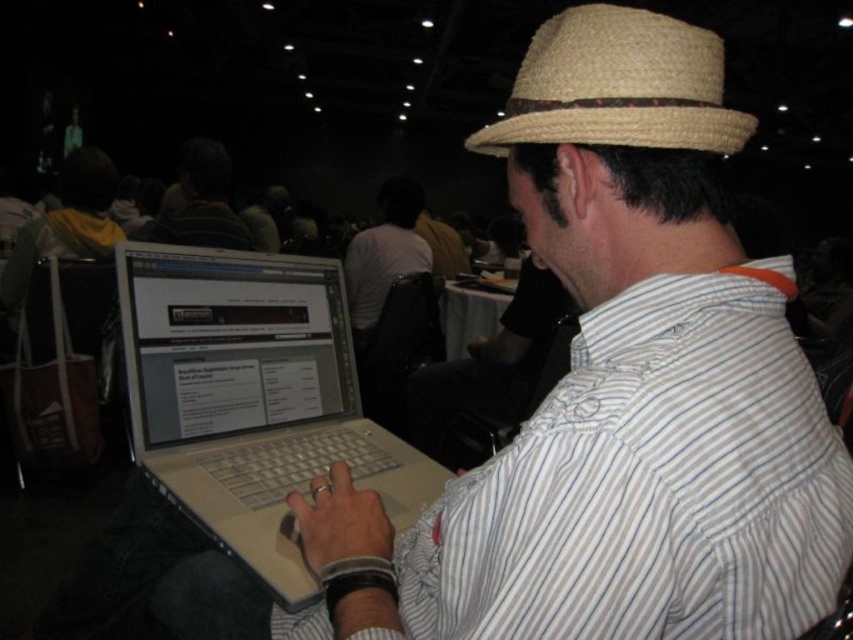
You are standing in the conference hall and want to take a photo of the point at coordinates point (679, 28). Your camera has a focal length of 50mm and a sensor size of 24mm. What is the minimum distance you need to move forward or backward to ensure the point is within the camera frame?

The point at coordinates point (679, 28) is 21.72 inches away from the viewer. To ensure it is within the camera frame, you need to adjust your distance based on the camera specifications. However, without knowing the required field of view or sensor resolution, an exact distance cannot be calculated. Please provide additional details about the desired framing or sensor resolution for a precise answer.

You are a photographer trying to capture a candid shot of the person at the conference. The white striped shirt at center and the silver metallic laptop at center are in your frame. Considering the focus distance, which object should you focus on to ensure both are in sharp focus if your camera has a depth of field that can cover 10 inches?

The white striped shirt at center and silver metallic laptop at center are 9.17 inches apart, so focusing on either one would keep both in sharp focus since the distance between them is within the camera sensor depth of field range of 10 inches.